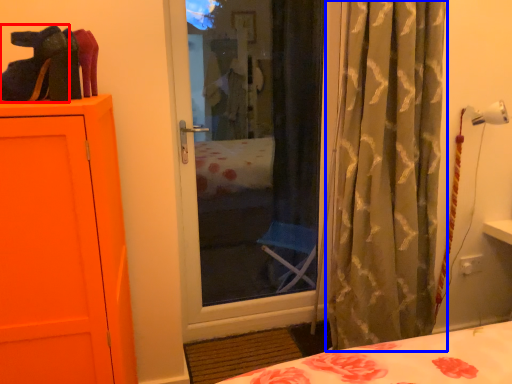
Question: Among these objects, which one is nearest to the camera, shoe (highlighted by a red box) or curtain (highlighted by a blue box)?

Choices:
 (A) shoe
 (B) curtain

Answer: (A)